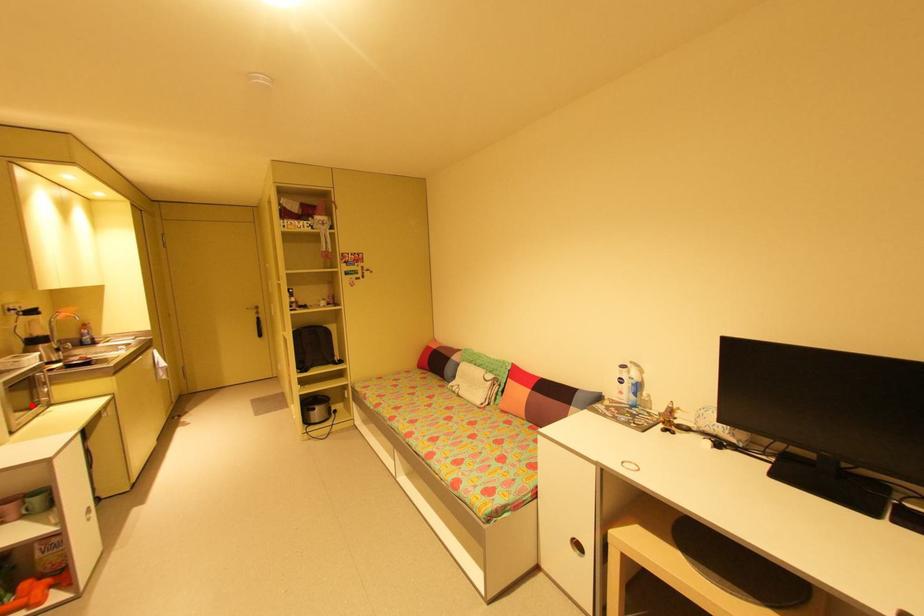
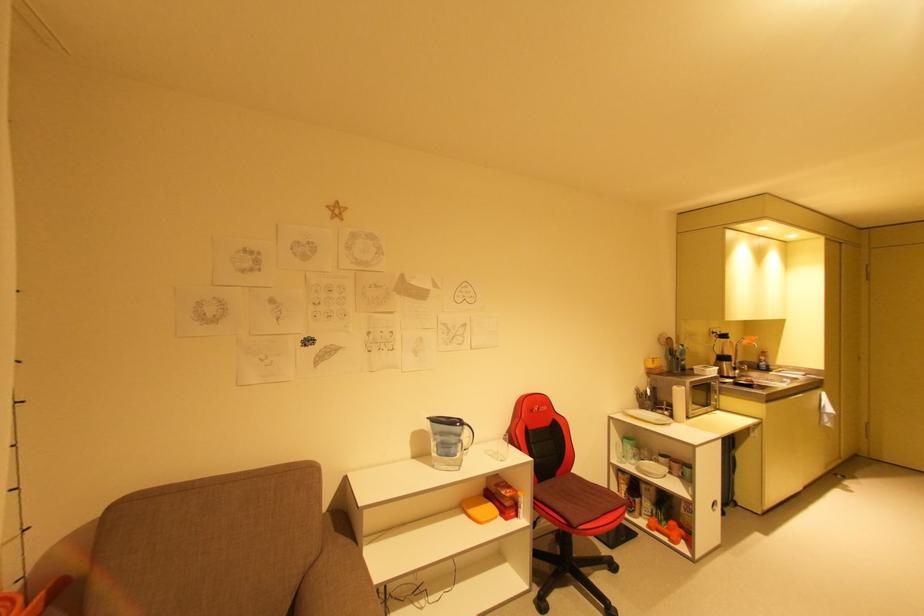
Find the pixel in the second image that matches the highlighted location in the first image.

(708, 403)